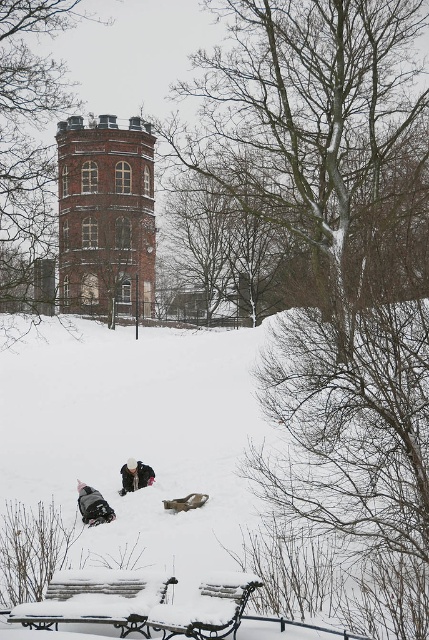
Can you confirm if snow-covered wood bench at lower left is positioned below dark gray snowsuit at lower left?

Incorrect, snow-covered wood bench at lower left is not positioned below dark gray snowsuit at lower left.

Which is behind, point (138, 596) or point (106, 502)?

The point (106, 502) is more distant.

At what (x,y) coordinates should I click in order to perform the action: click on snow-covered wood bench at lower left. Please return your answer as a coordinate pair (x, y). The width and height of the screenshot is (429, 640). Looking at the image, I should click on (96, 600).

Consider the image. Between snow-covered wooden bench at lower center and white snowsuit at lower center, which one is positioned higher?

snow-covered wooden bench at lower center

Describe the element at coordinates (207, 609) in the screenshot. I see `snow-covered wooden bench at lower center` at that location.

I want to click on snow-covered wooden bench at lower center, so tap(207, 609).

This screenshot has width=429, height=640. What are the coordinates of `snow-covered wooden bench at lower center` in the screenshot? It's located at (207, 609).

What do you see at coordinates (96, 600) in the screenshot?
I see `snow-covered wood bench at lower left` at bounding box center [96, 600].

Can you confirm if snow-covered wood bench at lower left is shorter than white snowsuit at lower center?

Correct, snow-covered wood bench at lower left is not as tall as white snowsuit at lower center.

The image size is (429, 640). I want to click on snow-covered wood bench at lower left, so click(x=96, y=600).